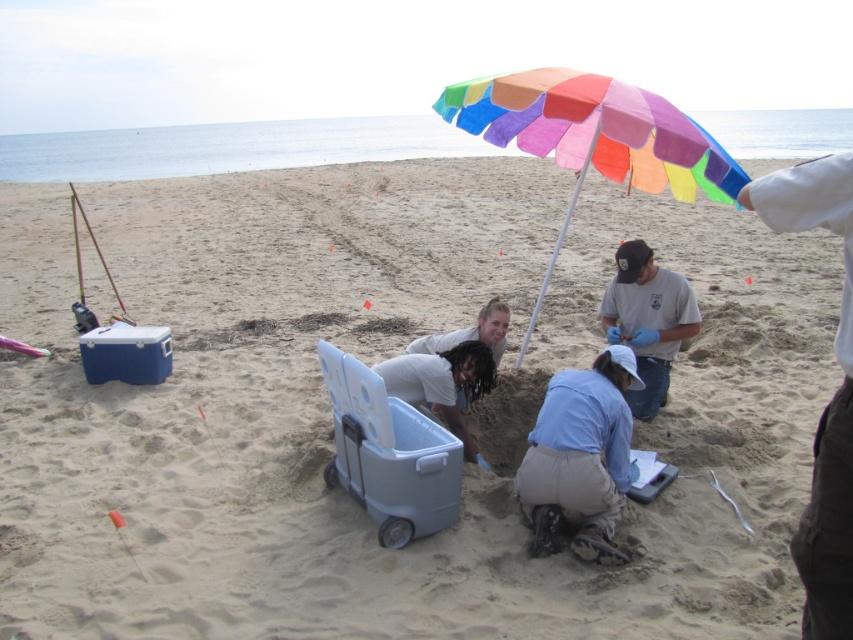
Is gray plastic cooler at center closer to the viewer compared to white matte cooler at center?

Yes, gray plastic cooler at center is closer to the viewer.

Does point (450, 493) come farther from viewer compared to point (445, 397)?

No, it is not.

Between point (363, 404) and point (454, 369), which one is positioned in front?

Positioned in front is point (363, 404).

Identify the location of gray plastic cooler at center. (389, 452).

Which is below, blue cotton shirt at lower center or gray plastic cooler at center?

blue cotton shirt at lower center

Is blue cotton shirt at lower center thinner than gray plastic cooler at center?

Correct, blue cotton shirt at lower center's width is less than gray plastic cooler at center's.

Describe the element at coordinates (579, 456) in the screenshot. Image resolution: width=853 pixels, height=640 pixels. I see `blue cotton shirt at lower center` at that location.

Identify the location of blue cotton shirt at lower center. This screenshot has width=853, height=640. (579, 456).

Is point (352, 470) more distant than point (674, 339)?

No, it is in front of (674, 339).

Which is above, gray plastic cooler at center or matte white shirt at center?

matte white shirt at center is higher up.

Is point (392, 442) positioned in front of point (643, 406)?

Yes, it is.

Locate an element on the screen. This screenshot has width=853, height=640. gray plastic cooler at center is located at coordinates (389, 452).